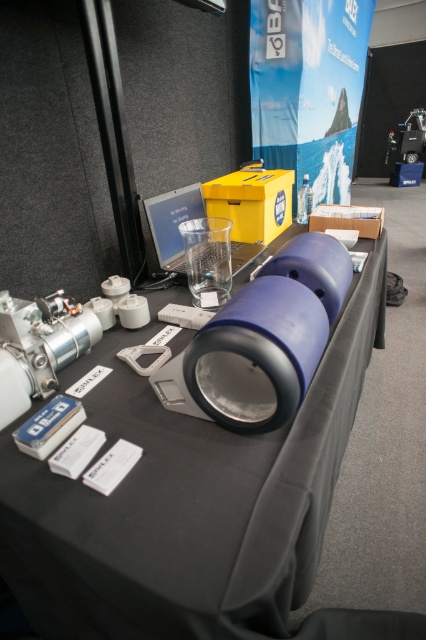
You are an engineer at the trade show and need to locate the blue plastic cylinder at center. According to the coordinates provided, where should you look on the table?

The blue plastic cylinder at center is located at point coordinates (187, 502) on the table.

You are an engineer inspecting the table at the exhibition. You need to access the clear plastic bottle at center for testing. Is the blue plastic cylinder at center blocking your direct access to it?

The blue plastic cylinder at center is located below the clear plastic bottle at center, so it is not blocking the direct access to the clear plastic bottle at center.

You are a technician at a trade show and need to locate the blue plastic cylinder at center. The coordinates provided are point (x=187, y=502). Is this point on the blue plastic cylinder at center?

Yes, the point (x=187, y=502) is on the blue plastic cylinder at center according to the description.